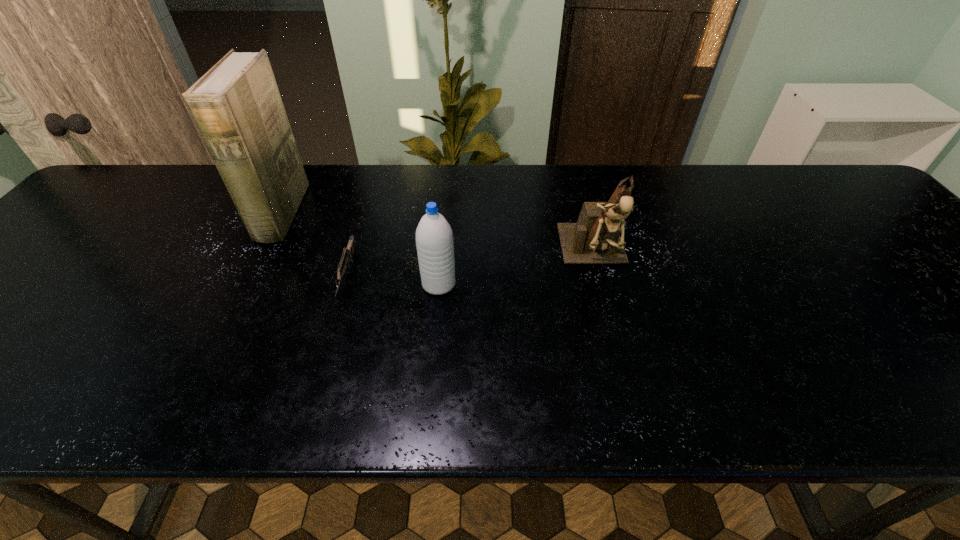
Find the location of a particular element. The image size is (960, 540). vacant region between the phonebook and the gun is located at coordinates (315, 245).

Find the location of a particular element. vacant space that's between the water bottle and the third shortest object is located at coordinates (516, 271).

Find the location of a particular element. Image resolution: width=960 pixels, height=540 pixels. empty space between the figurine and the third object from right to left is located at coordinates (471, 266).

The image size is (960, 540). I want to click on empty space between the gun and the second shortest object, so 394,280.

Identify the location of free space between the water bottle and the second object from left to right. (394, 280).

Image resolution: width=960 pixels, height=540 pixels. Find the location of `free space between the shortest object and the figurine`. free space between the shortest object and the figurine is located at coordinates (471, 266).

Where is `empty space that is in between the tallest object and the third object from left to right`? empty space that is in between the tallest object and the third object from left to right is located at coordinates (360, 249).

Choose which object is the third nearest neighbor to the phonebook. Please provide its 2D coordinates. Your answer should be formatted as a tuple, i.e. [(x, y)], where the tuple contains the x and y coordinates of a point satisfying the conditions above.

[(595, 239)]

Identify which object is the second closest to the leftmost object. Please provide its 2D coordinates. Your answer should be formatted as a tuple, i.e. [(x, y)], where the tuple contains the x and y coordinates of a point satisfying the conditions above.

[(434, 240)]

Where is `vacant region that satisfies the following two spatial constraints: 1. aimed along the barrel of the gun; 2. on the right side of the third object from left to right`? This screenshot has height=540, width=960. vacant region that satisfies the following two spatial constraints: 1. aimed along the barrel of the gun; 2. on the right side of the third object from left to right is located at coordinates (346, 284).